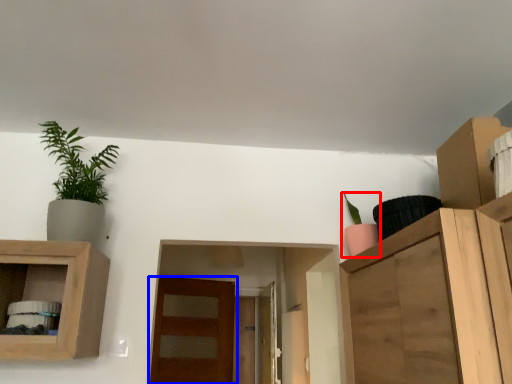
Question: Which object appears farthest to the camera in this image, houseplant (highlighted by a red box) or door (highlighted by a blue box)?

Choices:
 (A) houseplant
 (B) door

Answer: (B)